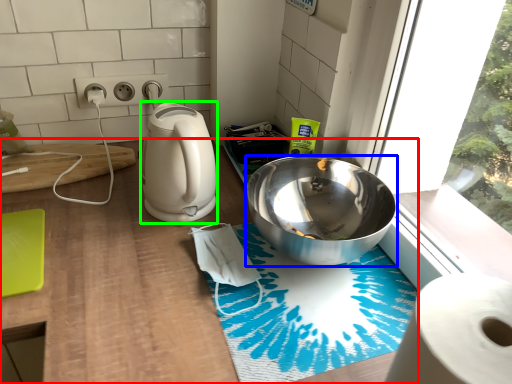
Question: Which object is the closest to the counter (highlighted by a red box)? Choose among these: bowl (highlighted by a blue box) or kitchen appliance (highlighted by a green box).

Choices:
 (A) bowl
 (B) kitchen appliance

Answer: (B)